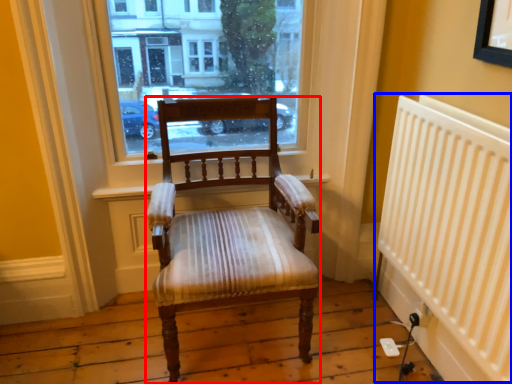
Question: Among these objects, which one is nearest to the camera, chair (highlighted by a red box) or radiator (highlighted by a blue box)?

Choices:
 (A) chair
 (B) radiator

Answer: (B)